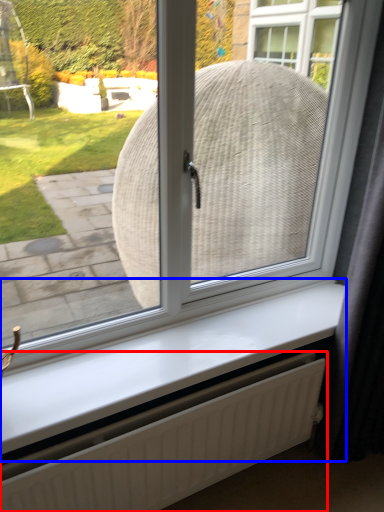
Question: Which object is closer to the camera taking this photo, radiator (highlighted by a red box) or window sill (highlighted by a blue box)?

Choices:
 (A) radiator
 (B) window sill

Answer: (A)